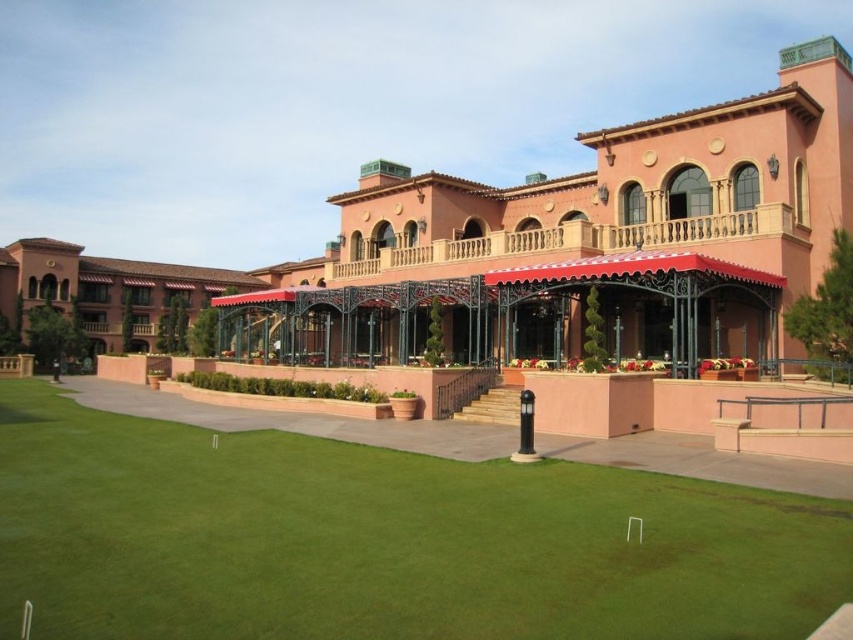
You are standing in front of the grand pink building and want to walk towards the green grass at center. Will you pass by the matte pink awning at center on your way?

The green grass at center is closer to the viewer than the matte pink awning at center, so you will not pass by the matte pink awning at center on your way to the green grass at center because it is behind you.

You are standing at the entrance of the grand pink building and want to find the green grass at center. Based on the coordinates provided, in which direction should you walk to reach it?

The green grass at center is located at point coordinates, so you should walk towards the center area of the scene to reach it.